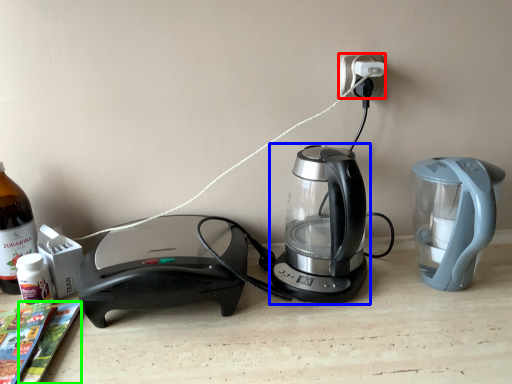
Question: Which object is positioned closest to electric outlet (highlighted by a red box)? Select from kettle (highlighted by a blue box) and magazine (highlighted by a green box).

Choices:
 (A) kettle
 (B) magazine

Answer: (A)